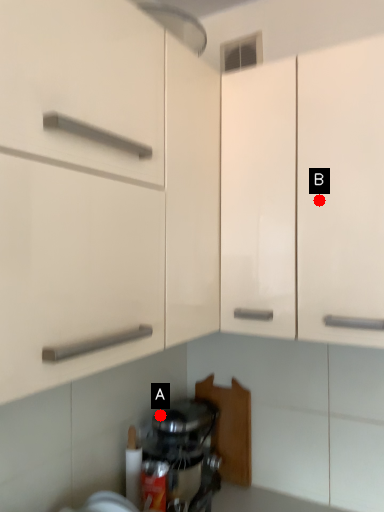
Question: Two points are circled on the image, labeled by A and B beside each circle. Which point appears closest to the camera in this image?

Choices:
 (A) A is closer
 (B) B is closer

Answer: (B)